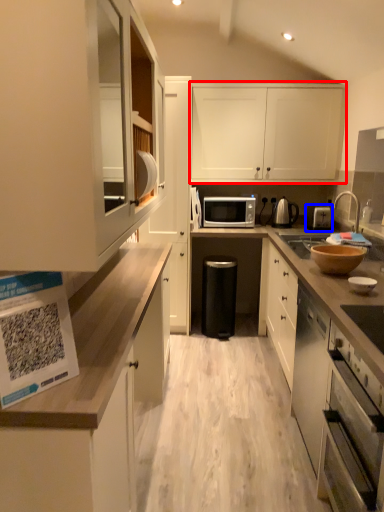
Question: Which of the following is the farthest to the observer, cabinetry (highlighted by a red box) or toaster (highlighted by a blue box)?

Choices:
 (A) cabinetry
 (B) toaster

Answer: (A)